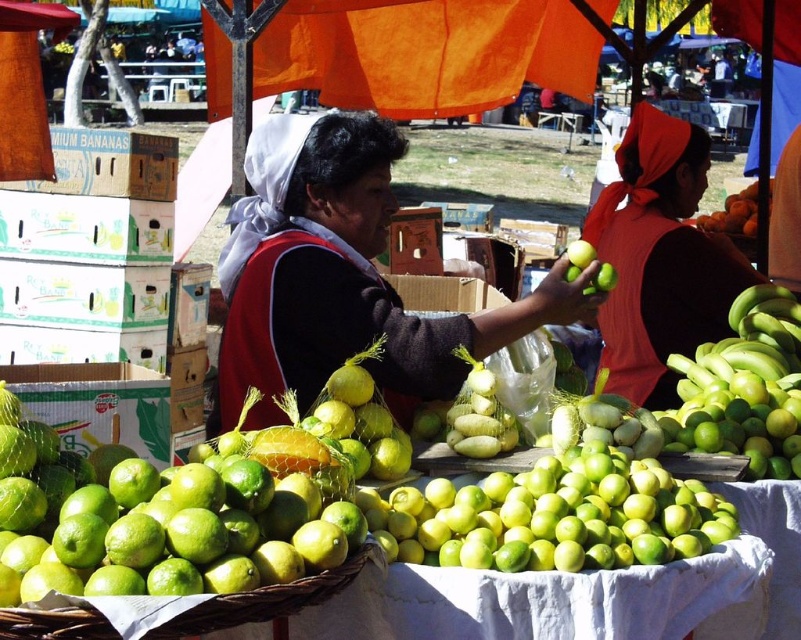
Based on the photo, you are a customer at the market and want to place both the matte black sweater at center and the smooth orange pumpkin at center into a single shopping bag. Based on their sizes, will they fit together?

The matte black sweater at center might be wider than the smooth orange pumpkin at center, so there is a possibility they can fit together in the shopping bag, but it depends on the bag size.

What is the exact coordinate of the matte black sweater at center?

The matte black sweater at center is located at coordinate point (x=341, y=278).